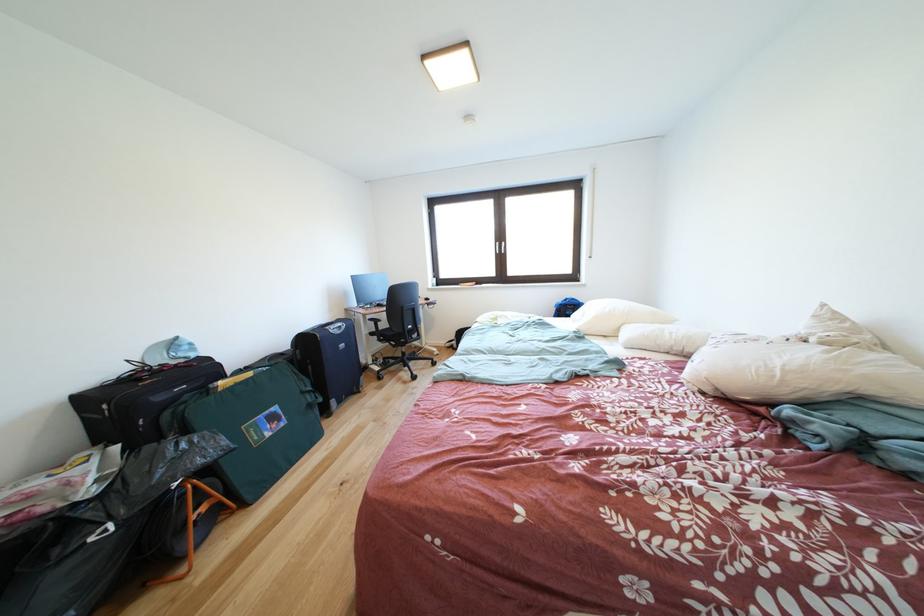
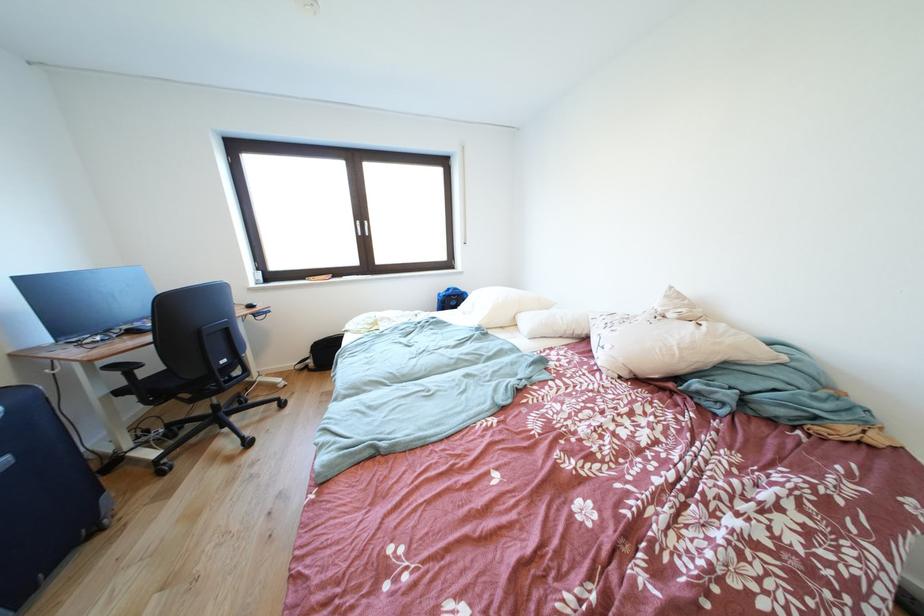
Find the pixel in the second image that matches (x=392, y=329) in the first image.

(161, 373)